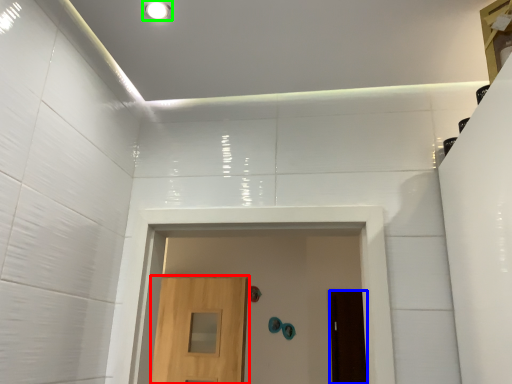
Question: Which object is the closest to the door (highlighted by a red box)? Choose among these: door (highlighted by a blue box) or lighting (highlighted by a green box).

Choices:
 (A) door
 (B) lighting

Answer: (A)